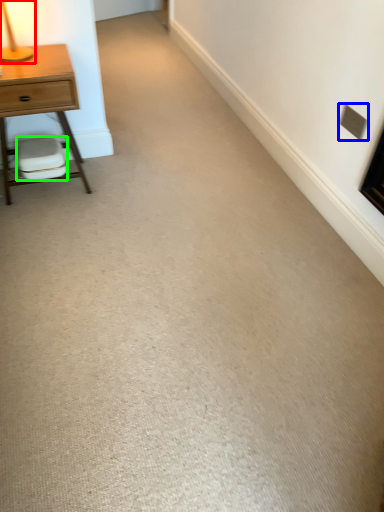
Question: Estimate the real-world distances between objects in this image. Which object is closer to table lamp (highlighted by a red box), electric outlet (highlighted by a blue box) or swivel chair (highlighted by a green box)?

Choices:
 (A) electric outlet
 (B) swivel chair

Answer: (B)